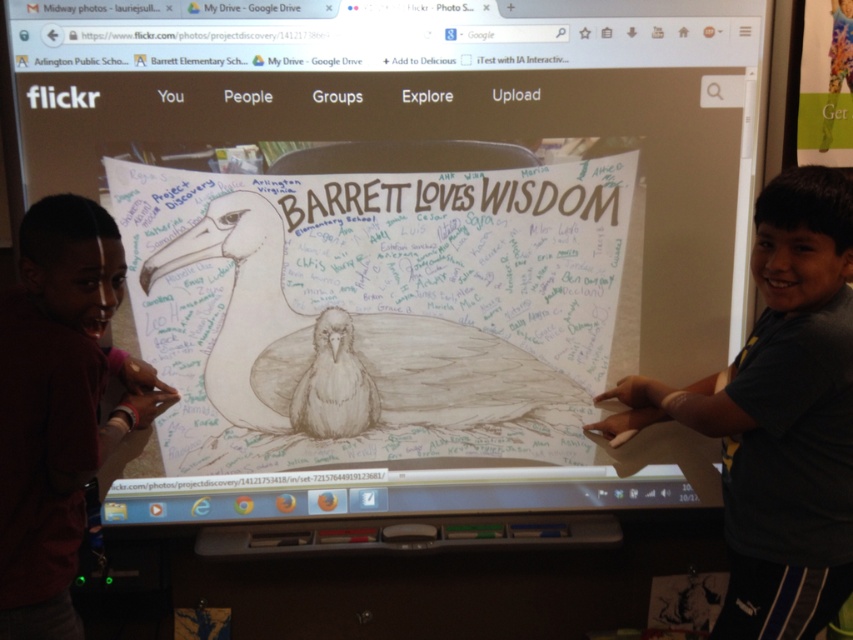
Between point (766, 372) and point (61, 456), which one is positioned behind?

Point (766, 372)

Is gray cotton shirt at right to the left of dark red shirt at left from the viewer's perspective?

No, gray cotton shirt at right is not to the left of dark red shirt at left.

Which is in front, point (804, 502) or point (83, 228)?

Point (83, 228) is in front.

I want to click on gray cotton shirt at right, so click(x=779, y=417).

Which is in front, point (780, 385) or point (595, 205)?

Point (780, 385)

Image resolution: width=853 pixels, height=640 pixels. Find the location of `gray cotton shirt at right`. gray cotton shirt at right is located at coordinates (779, 417).

Looking at this image, which is more to the right, dark red shirt at left or white chalkboard writing at center?

Positioned to the right is white chalkboard writing at center.

You are a GUI agent. You are given a task and a screenshot of the screen. Output one action in this format:
    pyautogui.click(x=<x>, y=<y>)
    Task: Click on the dark red shirt at left
    This screenshot has height=640, width=853.
    Given the screenshot: What is the action you would take?
    pyautogui.click(x=57, y=404)

Is point (91, 355) in front of point (618, 202)?

Yes, point (91, 355) is closer to viewer.

I want to click on dark red shirt at left, so click(57, 404).